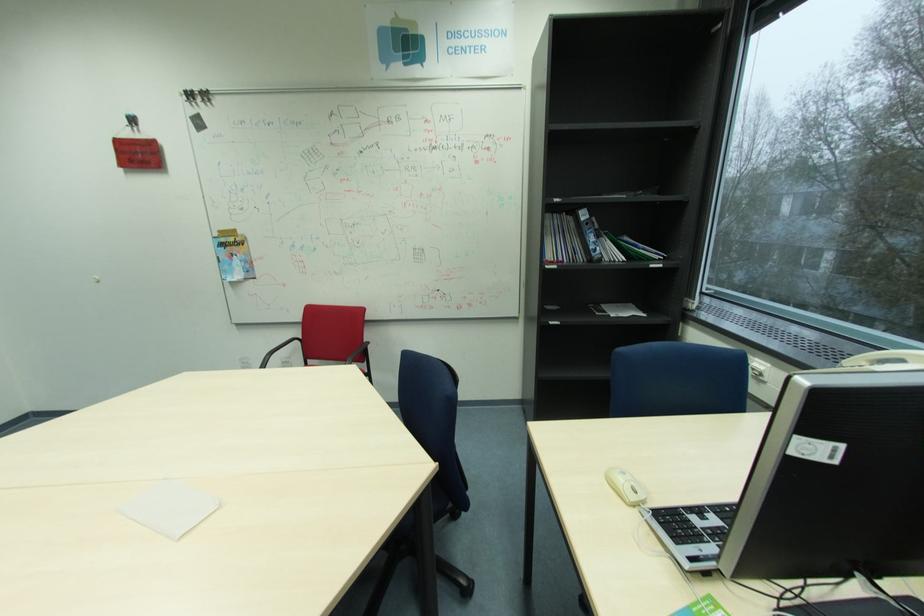
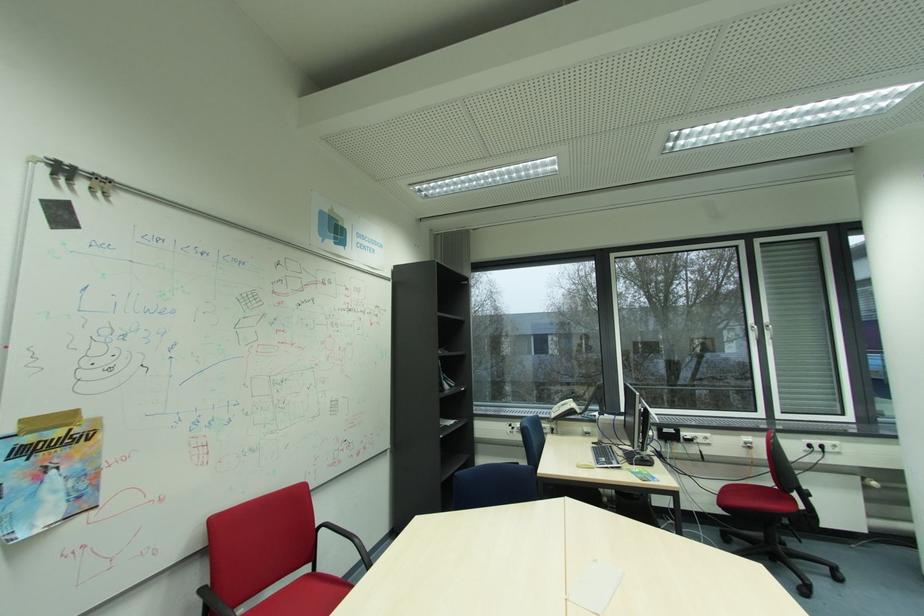
Find the pixel in the second image that matches [228,246] in the first image.

(31, 452)